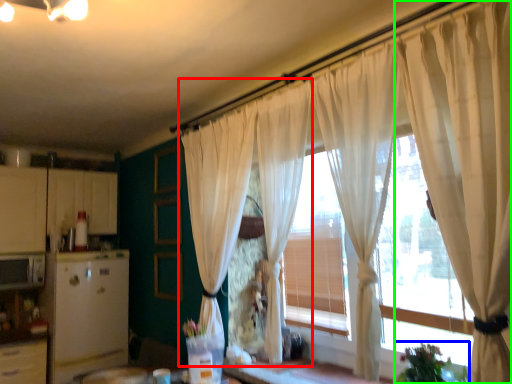
Question: Which object is positioned closest to curtain (highlighted by a red box)? Select from plant (highlighted by a blue box) and curtain (highlighted by a green box).

Choices:
 (A) plant
 (B) curtain

Answer: (B)